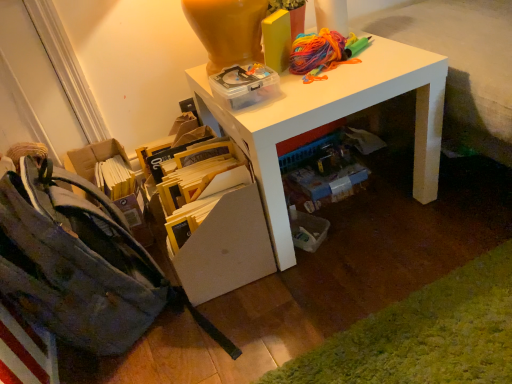
Measure the distance between white glossy desk at upper center and camera.

white glossy desk at upper center is 37.47 inches from camera.

Where is `white glossy desk at upper center`? This screenshot has height=384, width=512. white glossy desk at upper center is located at coordinates (333, 119).

Measure the distance between yellow cardboard at lower left and camera.

yellow cardboard at lower left and camera are 1.03 meters apart from each other.

This screenshot has height=384, width=512. What do you see at coordinates (197, 187) in the screenshot?
I see `yellow cardboard book at lower center` at bounding box center [197, 187].

This screenshot has width=512, height=384. Describe the element at coordinates (81, 264) in the screenshot. I see `floral canvas shoulder bag at lower left` at that location.

Identify the location of white glossy desk at upper center. (333, 119).

Are floral canvas shoulder bag at lower left and yellow cardboard book at lower center making contact?

floral canvas shoulder bag at lower left and yellow cardboard book at lower center are not in contact.

From the image's perspective, who appears lower, floral canvas shoulder bag at lower left or yellow cardboard book at lower center?

floral canvas shoulder bag at lower left.

Which is nearer, (131, 246) or (197, 148)?

Point (131, 246) is positioned closer to the camera compared to point (197, 148).

This screenshot has width=512, height=384. I want to click on desk behind the yellow cardboard at lower left, so click(333, 119).

Which object is thinner, yellow cardboard at lower left or white glossy desk at upper center?

With smaller width is white glossy desk at upper center.

Is white glossy desk at upper center a part of yellow cardboard at lower left?

No, white glossy desk at upper center is located outside of yellow cardboard at lower left.

From a real-world perspective, relative to yellow cardboard book at lower center, is yellow cardboard at lower left vertically above or below?

yellow cardboard at lower left is below yellow cardboard book at lower center.

Is yellow cardboard at lower left directly adjacent to yellow cardboard book at lower center?

Yes, yellow cardboard at lower left is beside yellow cardboard book at lower center.

Is yellow cardboard at lower left not within yellow cardboard book at lower center?

Yes.

Which is in front, point (236, 251) or point (177, 201)?

The point (236, 251) is closer to the camera.

Is floral canvas shoulder bag at lower left positioned with its back to yellow cardboard at lower left?

No, floral canvas shoulder bag at lower left is not facing away from yellow cardboard at lower left.

Do you think floral canvas shoulder bag at lower left is within yellow cardboard at lower left, or outside of it?

floral canvas shoulder bag at lower left is not enclosed by yellow cardboard at lower left.

Considering the relative positions of floral canvas shoulder bag at lower left and yellow cardboard at lower left in the image provided, is floral canvas shoulder bag at lower left to the left of yellow cardboard at lower left from the viewer's perspective?

Indeed, floral canvas shoulder bag at lower left is positioned on the left side of yellow cardboard at lower left.

Is floral canvas shoulder bag at lower left touching yellow cardboard at lower left?

floral canvas shoulder bag at lower left is not next to yellow cardboard at lower left, and they're not touching.

Does yellow cardboard at lower left turn towards floral canvas shoulder bag at lower left?

No, yellow cardboard at lower left is not aimed at floral canvas shoulder bag at lower left.

Can floral canvas shoulder bag at lower left be found inside yellow cardboard at lower left?

No, floral canvas shoulder bag at lower left is not inside yellow cardboard at lower left.

How different are the orientations of yellow cardboard book at lower center and yellow cardboard at lower left in degrees?

yellow cardboard book at lower center and yellow cardboard at lower left are facing 90 degrees away from each other.

Does yellow cardboard book at lower center have a lesser height compared to yellow cardboard at lower left?

Yes, yellow cardboard book at lower center is shorter than yellow cardboard at lower left.

Considering the positions of objects yellow cardboard book at lower center and yellow cardboard at lower left in the image provided, who is more to the left, yellow cardboard book at lower center or yellow cardboard at lower left?

From the viewer's perspective, yellow cardboard at lower left appears more on the left side.

Between yellow cardboard book at lower center and yellow cardboard at lower left, which one has smaller width?

Result: yellow cardboard book at lower center.

Between yellow cardboard book at lower center and white glossy desk at upper center, which one has larger width?

Wider between the two is white glossy desk at upper center.

Is yellow cardboard book at lower center outside of white glossy desk at upper center?

Indeed, yellow cardboard book at lower center is completely outside white glossy desk at upper center.

Is yellow cardboard book at lower center facing away from white glossy desk at upper center?

Yes, yellow cardboard book at lower center is positioned with its back facing white glossy desk at upper center.

From a real-world perspective, is yellow cardboard book at lower center positioned under white glossy desk at upper center based on gravity?

Yes.

In order to click on shoulder bag on the left of yellow cardboard book at lower center in this screenshot , I will do `click(81, 264)`.

The width and height of the screenshot is (512, 384). I want to click on shelf located below the white glossy desk at upper center (from the image's perspective), so click(x=216, y=226).

Estimate the real-world distances between objects in this image. Which object is further from white glossy desk at upper center, yellow cardboard at lower left or yellow cardboard book at lower center?

Based on the image, yellow cardboard book at lower center appears to be further to white glossy desk at upper center.

Based on their spatial positions, is white glossy desk at upper center or yellow cardboard book at lower center further from yellow cardboard at lower left?

white glossy desk at upper center.

When comparing their distances from yellow cardboard book at lower center, does white glossy desk at upper center or floral canvas shoulder bag at lower left seem further?

white glossy desk at upper center lies further to yellow cardboard book at lower center than the other object.

Which object lies nearer to the anchor point white glossy desk at upper center, yellow cardboard at lower left or floral canvas shoulder bag at lower left?

yellow cardboard at lower left is closer to white glossy desk at upper center.

Considering their positions, is floral canvas shoulder bag at lower left positioned further to white glossy desk at upper center than yellow cardboard at lower left?

floral canvas shoulder bag at lower left is further to white glossy desk at upper center.

Looking at the image, which one is located further to yellow cardboard book at lower center, floral canvas shoulder bag at lower left or yellow cardboard at lower left?

floral canvas shoulder bag at lower left.

Estimate the real-world distances between objects in this image. Which object is further from white glossy desk at upper center, floral canvas shoulder bag at lower left or yellow cardboard book at lower center?

The object further to white glossy desk at upper center is floral canvas shoulder bag at lower left.

Based on the photo, considering their positions, is yellow cardboard at lower left positioned further to floral canvas shoulder bag at lower left than white glossy desk at upper center?

Based on the image, white glossy desk at upper center appears to be further to floral canvas shoulder bag at lower left.

This screenshot has height=384, width=512. I want to click on shelf situated between floral canvas shoulder bag at lower left and white glossy desk at upper center from left to right, so click(x=216, y=226).

Find the location of a particular element. Image resolution: width=512 pixels, height=384 pixels. book between floral canvas shoulder bag at lower left and white glossy desk at upper center in the horizontal direction is located at coordinates (197, 187).

Locate an element on the screen. The height and width of the screenshot is (384, 512). shelf located between floral canvas shoulder bag at lower left and yellow cardboard book at lower center in the depth direction is located at coordinates (216, 226).

Identify the location of book between yellow cardboard at lower left and white glossy desk at upper center in the horizontal direction. Image resolution: width=512 pixels, height=384 pixels. (197, 187).